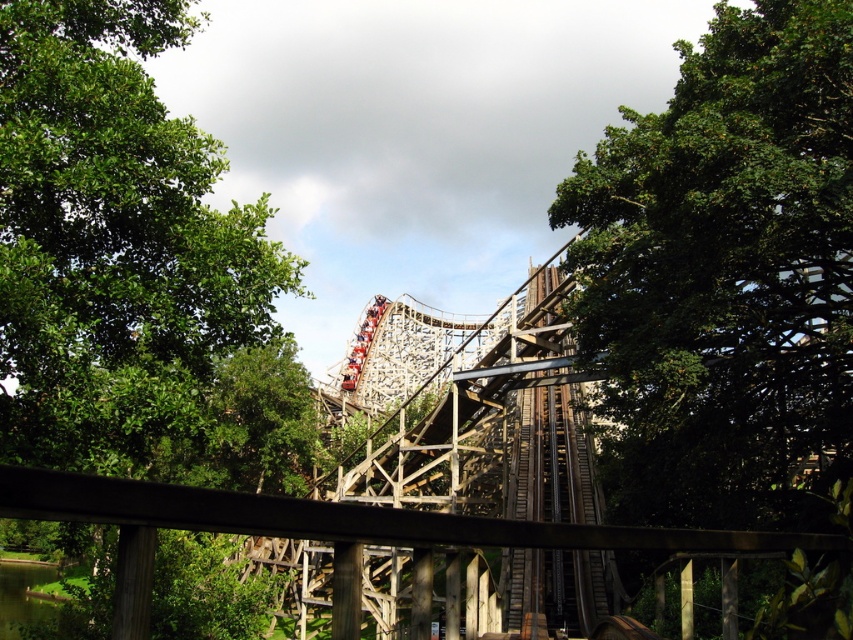
Question: Is green leafy tree at center to the right of green leafy tree at left from the viewer's perspective?

Choices:
 (A) yes
 (B) no

Answer: (A)

Question: Is the position of green leafy tree at center more distant than that of green leafy tree at left?

Choices:
 (A) yes
 (B) no

Answer: (B)

Question: Can you confirm if green leafy tree at center is smaller than green leafy tree at left?

Choices:
 (A) yes
 (B) no

Answer: (A)

Question: Among these points, which one is farthest from the camera?

Choices:
 (A) (62, 332)
 (B) (822, 328)

Answer: (B)